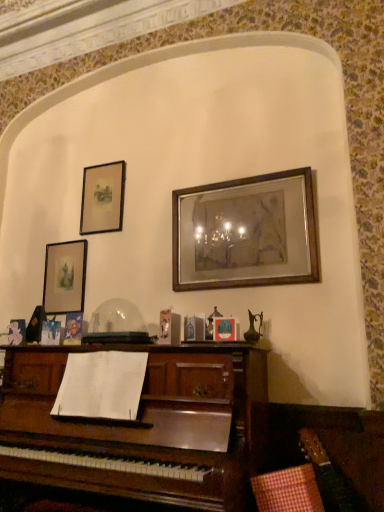
Question: Would you consider matte black picture frame at upper left, the 2th picture frame when ordered from left to right, to be distant from wooden picture frame at center, which ranks as the first picture frame in right-to-left order?

Choices:
 (A) yes
 (B) no

Answer: (B)

Question: Is matte black picture frame at upper left, which ranks as the second picture frame in right-to-left order, closer to the viewer compared to wooden picture frame at center, placed as the 3th picture frame when sorted from left to right?

Choices:
 (A) yes
 (B) no

Answer: (B)

Question: Does matte black picture frame at upper left, which ranks as the second picture frame in right-to-left order, have a larger size compared to wooden picture frame at center, placed as the 3th picture frame when sorted from left to right?

Choices:
 (A) yes
 (B) no

Answer: (B)

Question: From a real-world perspective, is matte black picture frame at upper left, the 2th picture frame when ordered from left to right, beneath wooden picture frame at center, placed as the 3th picture frame when sorted from left to right?

Choices:
 (A) no
 (B) yes

Answer: (A)

Question: Can you confirm if matte black picture frame at upper left, which ranks as the second picture frame in right-to-left order, is taller than wooden picture frame at center, which ranks as the first picture frame in right-to-left order?

Choices:
 (A) no
 (B) yes

Answer: (A)

Question: Does matte black picture frame at upper left, which ranks as the second picture frame in right-to-left order, appear on the right side of wooden picture frame at center, which ranks as the first picture frame in right-to-left order?

Choices:
 (A) yes
 (B) no

Answer: (B)

Question: Can you confirm if wooden picture frame at center, placed as the 3th picture frame when sorted from left to right, is thinner than matte gold picture frame at upper left, positioned as the 3th picture frame in right-to-left order?

Choices:
 (A) yes
 (B) no

Answer: (B)

Question: Is wooden picture frame at center, placed as the 3th picture frame when sorted from left to right, to the right of matte gold picture frame at upper left, positioned as the first picture frame in left-to-right order, from the viewer's perspective?

Choices:
 (A) no
 (B) yes

Answer: (B)

Question: Is wooden picture frame at center, placed as the 3th picture frame when sorted from left to right, next to matte gold picture frame at upper left, positioned as the first picture frame in left-to-right order?

Choices:
 (A) yes
 (B) no

Answer: (B)

Question: Is the position of wooden picture frame at center, placed as the 3th picture frame when sorted from left to right, less distant than that of matte gold picture frame at upper left, positioned as the first picture frame in left-to-right order?

Choices:
 (A) yes
 (B) no

Answer: (A)

Question: From the image's perspective, is wooden picture frame at center, placed as the 3th picture frame when sorted from left to right, under matte gold picture frame at upper left, positioned as the 3th picture frame in right-to-left order?

Choices:
 (A) yes
 (B) no

Answer: (B)

Question: Considering the relative sizes of wooden picture frame at center, placed as the 3th picture frame when sorted from left to right, and matte gold picture frame at upper left, positioned as the 3th picture frame in right-to-left order, in the image provided, is wooden picture frame at center, placed as the 3th picture frame when sorted from left to right, shorter than matte gold picture frame at upper left, positioned as the 3th picture frame in right-to-left order,?

Choices:
 (A) no
 (B) yes

Answer: (A)

Question: Considering the relative sizes of matte gold picture frame at upper left, positioned as the 3th picture frame in right-to-left order, and matte black picture frame at upper left, the 2th picture frame when ordered from left to right, in the image provided, is matte gold picture frame at upper left, positioned as the 3th picture frame in right-to-left order, taller than matte black picture frame at upper left, the 2th picture frame when ordered from left to right,?

Choices:
 (A) yes
 (B) no

Answer: (A)